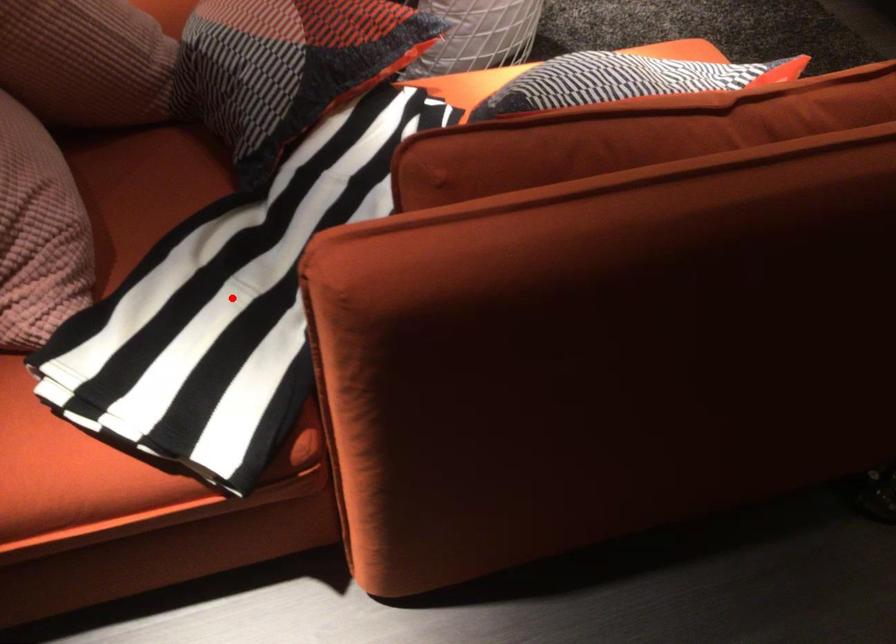
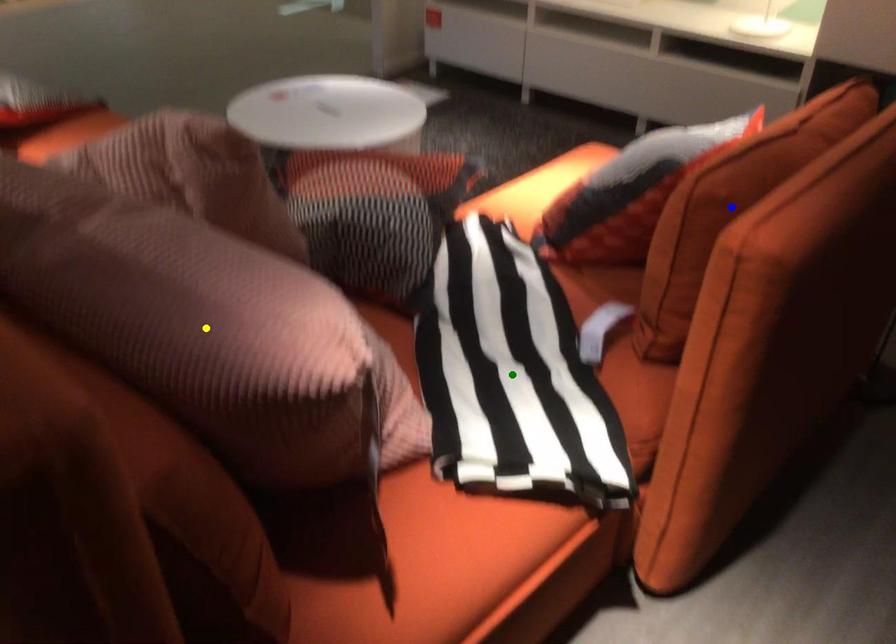
Question: I am providing you with two images of the same scene from different viewpoints. A red point is marked on the first image. You are given multiple points on the second image. Can you choose the point in image 2 that corresponds to the point in image 1?

Choices:
 (A) yellow point
 (B) blue point
 (C) green point

Answer: (C)